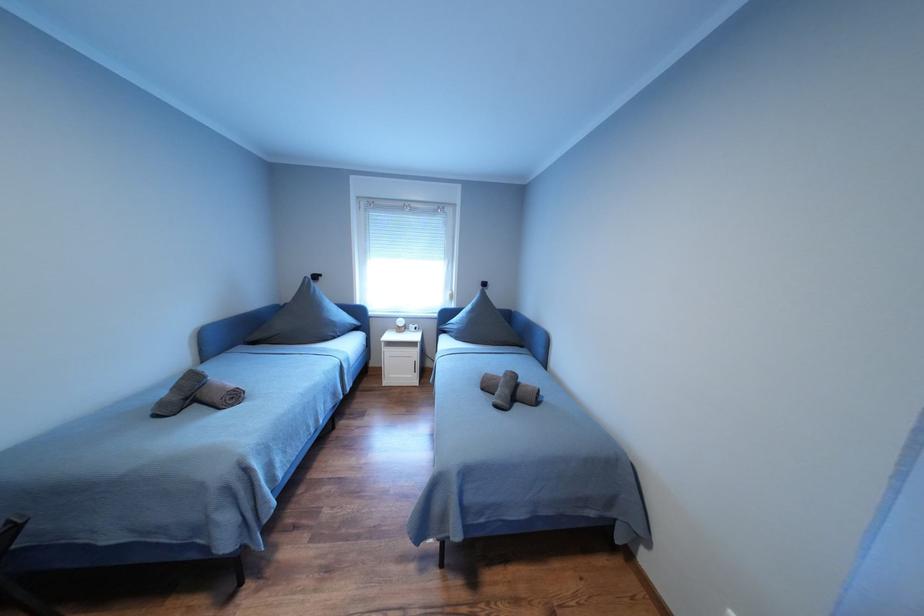
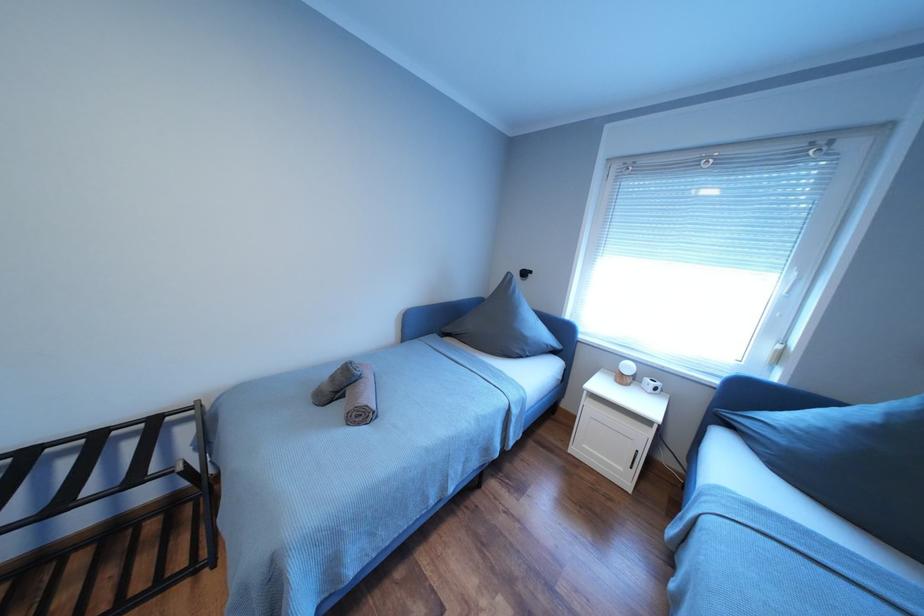
Question: The images are taken continuously from a first-person perspective. In which direction is your viewpoint rotating?

Choices:
 (A) Left
 (B) Right
 (C) Up
 (D) Down

Answer: (A)